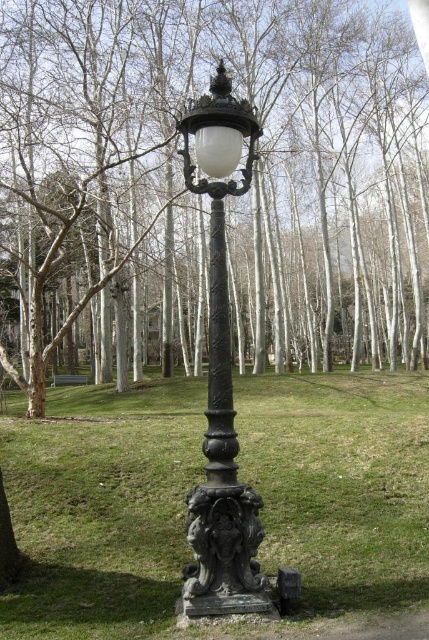
Question: Is black cast iron street light at center positioned at the back of matte black lamp post at center?

Choices:
 (A) no
 (B) yes

Answer: (A)

Question: Which object appears closest to the camera in this image?

Choices:
 (A) matte black lamp post at center
 (B) green grass at center
 (C) brown wood tree at center
 (D) black cast iron street light at center

Answer: (B)

Question: Can you confirm if green grass at center is thinner than black cast iron pole at center?

Choices:
 (A) yes
 (B) no

Answer: (B)

Question: Which object is closer to the camera taking this photo?

Choices:
 (A) black cast iron street light at center
 (B) black cast iron pole at center

Answer: (A)

Question: Is green grass at center below green wooden bench at center?

Choices:
 (A) yes
 (B) no

Answer: (B)

Question: Estimate the real-world distances between objects in this image. Which object is closer to the green wooden bench at center?

Choices:
 (A) matte black lamp post at center
 (B) brown wood tree at center
 (C) green grass at center

Answer: (B)